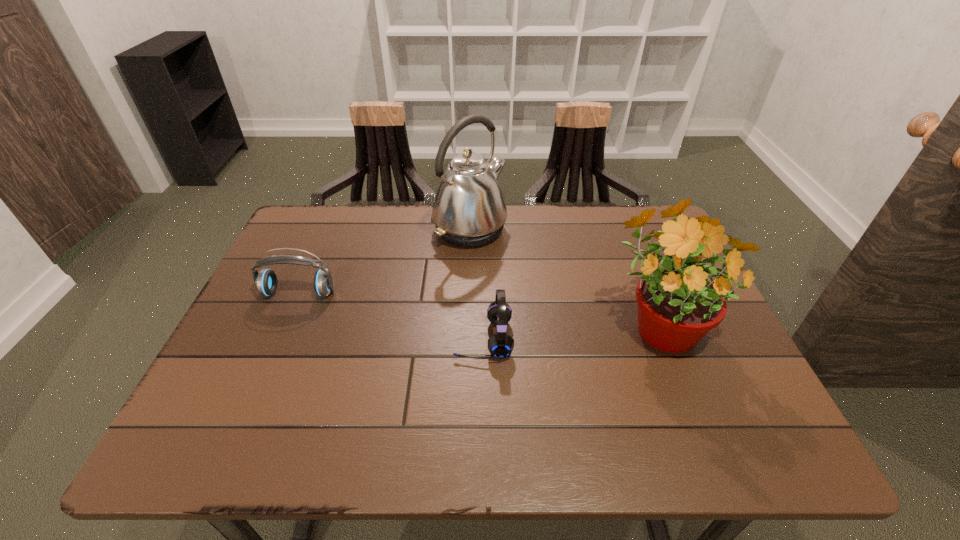
At what (x,y) coordinates should I click in order to perform the action: click on the farthest object. Please return your answer as a coordinate pair (x, y). Looking at the image, I should click on (469, 210).

Locate an element on the screen. the rightmost object is located at coordinates (678, 304).

The image size is (960, 540). In order to click on the farther headset in this screenshot , I will do `click(266, 281)`.

Find the location of `the leftmost object`. the leftmost object is located at coordinates (266, 281).

The height and width of the screenshot is (540, 960). In order to click on the nearer headset in this screenshot , I will do `click(500, 345)`.

The image size is (960, 540). Identify the location of free region located 0.100m on the right of the kettle. (540, 230).

Locate an element on the screen. This screenshot has height=540, width=960. free spot located 0.230m on the back of the rightmost object is located at coordinates (623, 234).

Where is `vacant space located 0.050m on the ear cups of the left headset`? The height and width of the screenshot is (540, 960). vacant space located 0.050m on the ear cups of the left headset is located at coordinates (288, 317).

You are a GUI agent. You are given a task and a screenshot of the screen. Output one action in this format:
    pyautogui.click(x=<x>, y=<y>)
    Task: Click on the vacant area situated 0.200m on the ear cushions of the right headset
    This screenshot has width=960, height=540.
    Given the screenshot: What is the action you would take?
    pyautogui.click(x=368, y=339)

I want to click on free space located on the ear cushions of the right headset, so click(284, 339).